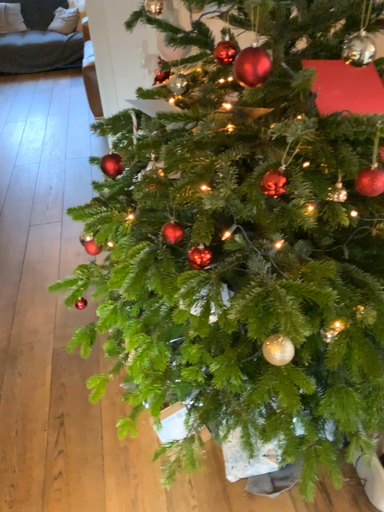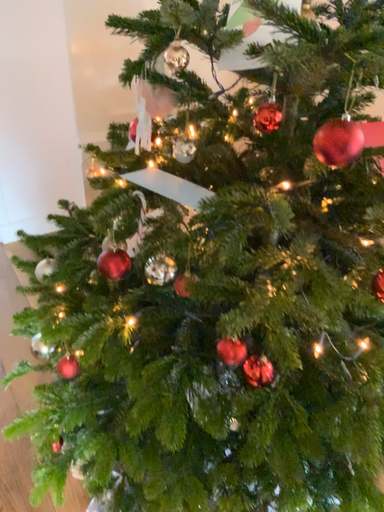
Question: How did the camera likely rotate when shooting the video?

Choices:
 (A) rotated left
 (B) rotated right

Answer: (B)